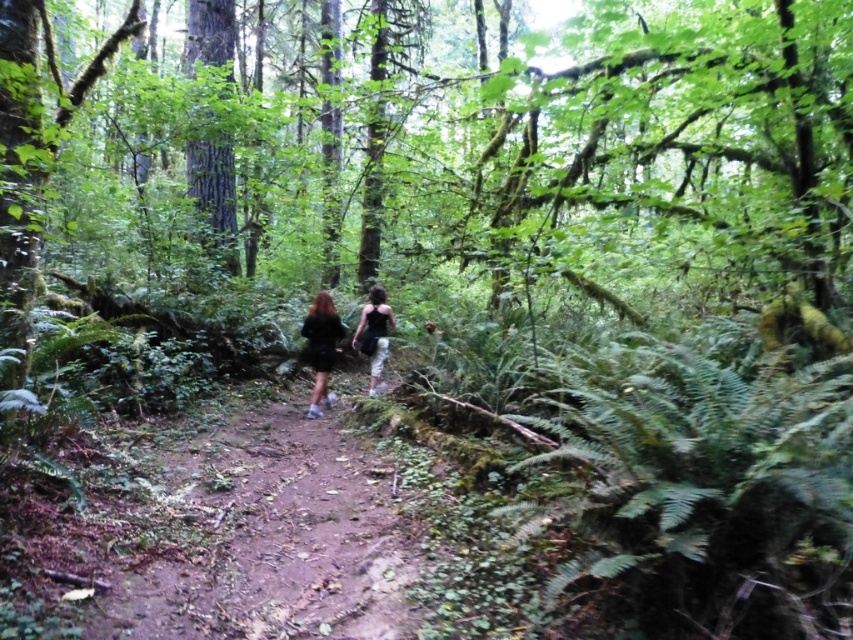
You are a hiker planning to walk along the dirt path at center. You notice the black matte dress at center is placed on the path. Is the dress blocking your way?

The dirt path at center is below black matte dress at center, meaning the dress is placed above the path. Therefore, the dress is not blocking your way as it is positioned above the path.

In the forest scene, where exactly is the black matte dress at center located in terms of coordinates?

The black matte dress at center is located at point coordinates of (321, 346).

You are a hiker who wants to take a photo of both the black matte dress at center and the black fabric dress at center. Since you want them both to be in focus, you need to know which one is larger. Which dress is larger?

The black matte dress at center is bigger than the black fabric dress at center, so you should focus on the black matte dress at center first to ensure both are in focus.